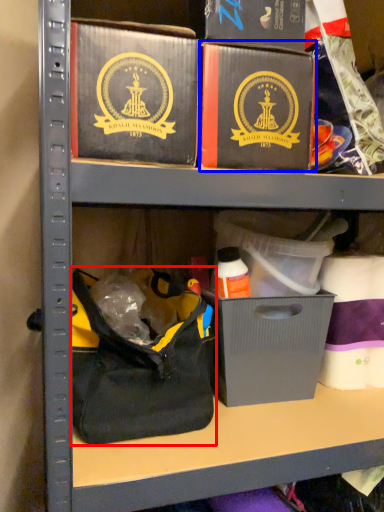
Question: Which point is closer to the camera, handbag (highlighted by a red box) or box (highlighted by a blue box)?

Choices:
 (A) handbag
 (B) box

Answer: (B)